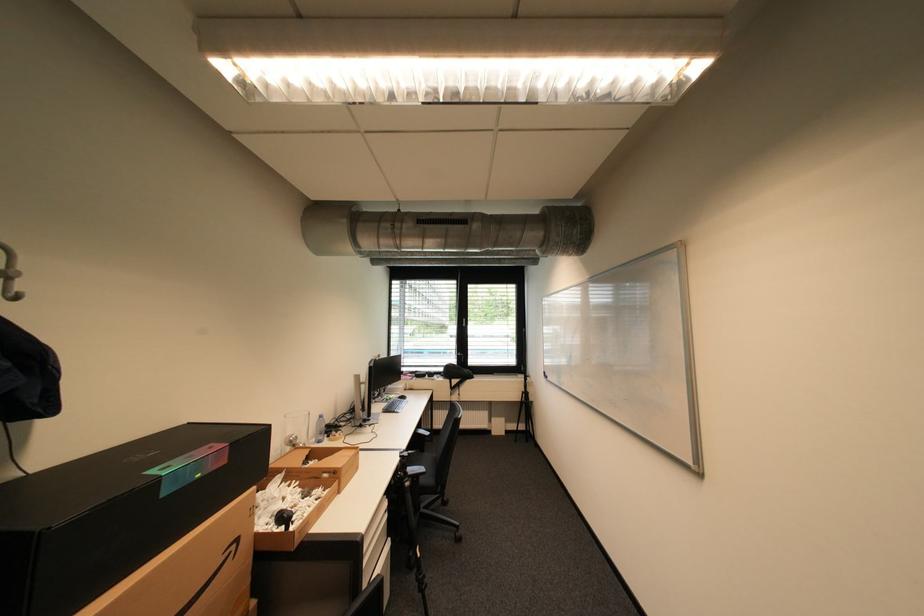
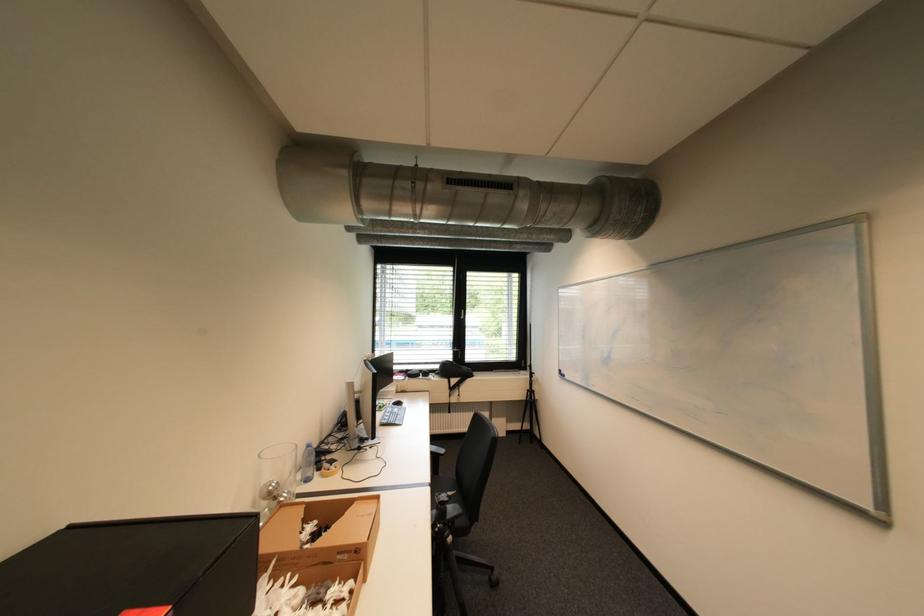
Locate, in the second image, the point that corresponds to point 450,370 in the first image.

(445, 368)